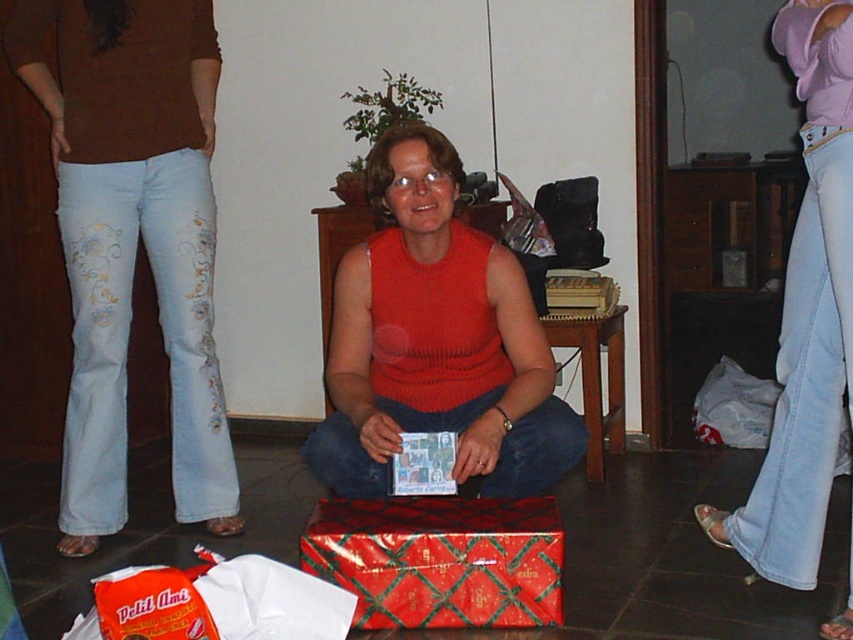
Does shiny red wrapping paper at center have a greater height compared to wooden stool at center?

No.

Consider the image. Is shiny red wrapping paper at center to the right of wooden stool at center from the viewer's perspective?

In fact, shiny red wrapping paper at center is to the left of wooden stool at center.

Is point (376, 532) positioned behind point (570, 385)?

No, (376, 532) is in front of (570, 385).

This screenshot has width=853, height=640. Find the location of `shiny red wrapping paper at center`. shiny red wrapping paper at center is located at coordinates (440, 561).

Can you confirm if red knitted tank top at center is wider than shiny red wrapping paper at center?

Yes.

Does red knitted tank top at center appear on the left side of shiny red wrapping paper at center?

Indeed, red knitted tank top at center is positioned on the left side of shiny red wrapping paper at center.

What do you see at coordinates (436, 340) in the screenshot?
I see `red knitted tank top at center` at bounding box center [436, 340].

You are a GUI agent. You are given a task and a screenshot of the screen. Output one action in this format:
    pyautogui.click(x=<x>, y=<y>)
    Task: Click on the red knitted tank top at center
    
    Given the screenshot: What is the action you would take?
    pyautogui.click(x=436, y=340)

Is point (151, 259) in front of point (752, 497)?

No, (151, 259) is further to viewer.

Is point (165, 296) farther from viewer compared to point (798, 276)?

Yes, it is.

The image size is (853, 640). What are the coordinates of `light blue denim jeans at left` in the screenshot? It's located at 132,241.